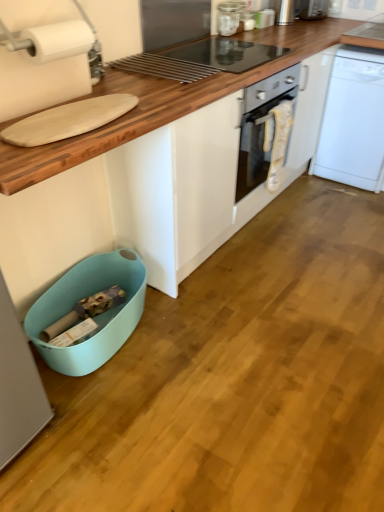
Question: Should I look upward or downward to see clear glass jar at upper center, placed as the fourth appliance when sorted from back to front?

Choices:
 (A) up
 (B) down

Answer: (A)

Question: Considering the relative sizes of wooden cutting board at upper left and clear glass jar at upper center, which is the 2th appliance from bottom to top, in the image provided, is wooden cutting board at upper left shorter than clear glass jar at upper center, which is the 2th appliance from bottom to top,?

Choices:
 (A) yes
 (B) no

Answer: (B)

Question: Is clear glass jar at upper center, which is the 2th appliance from bottom to top, at the back of wooden cutting board at upper left?

Choices:
 (A) no
 (B) yes

Answer: (A)

Question: From a real-world perspective, is wooden cutting board at upper left positioned under clear glass jar at upper center, acting as the 4th appliance starting from the right, based on gravity?

Choices:
 (A) yes
 (B) no

Answer: (A)

Question: Is the depth of wooden cutting board at upper left greater than that of clear glass jar at upper center, the second appliance from the front?

Choices:
 (A) yes
 (B) no

Answer: (B)

Question: Is wooden cutting board at upper left oriented towards clear glass jar at upper center, which is the 2th appliance from bottom to top?

Choices:
 (A) yes
 (B) no

Answer: (B)

Question: Is wooden cutting board at upper left thinner than clear glass jar at upper center, placed as the fourth appliance when sorted from back to front?

Choices:
 (A) no
 (B) yes

Answer: (A)

Question: Considering the relative sizes of clear glass jar at upper center, the second appliance from the front, and metallic silver toaster at upper center, the 1th appliance when ordered from bottom to top, in the image provided, is clear glass jar at upper center, the second appliance from the front, thinner than metallic silver toaster at upper center, the 1th appliance when ordered from bottom to top,?

Choices:
 (A) no
 (B) yes

Answer: (A)

Question: Is clear glass jar at upper center, acting as the 4th appliance starting from the right, turned away from metallic silver toaster at upper center, which is the 5th appliance in back-to-front order?

Choices:
 (A) no
 (B) yes

Answer: (A)

Question: Would you say clear glass jar at upper center, the 2th appliance in the left-to-right sequence, contains metallic silver toaster at upper center, the 1th appliance when ordered from bottom to top?

Choices:
 (A) no
 (B) yes

Answer: (A)

Question: Does clear glass jar at upper center, acting as the 4th appliance starting from the right, appear on the right side of metallic silver toaster at upper center, marked as the 1th appliance in a front-to-back arrangement?

Choices:
 (A) no
 (B) yes

Answer: (B)

Question: Is clear glass jar at upper center, the 2th appliance in the left-to-right sequence, closer to camera compared to metallic silver toaster at upper center, the fifth appliance viewed from the right?

Choices:
 (A) no
 (B) yes

Answer: (A)

Question: From the image's perspective, would you say clear glass jar at upper center, which is the 2th appliance from bottom to top, is positioned over metallic silver toaster at upper center, which is the 5th appliance in back-to-front order?

Choices:
 (A) no
 (B) yes

Answer: (B)

Question: Is satin silver toaster at upper right, arranged as the 5th appliance when ordered from the bottom, bigger than teal plastic dish washer at lower left?

Choices:
 (A) no
 (B) yes

Answer: (A)